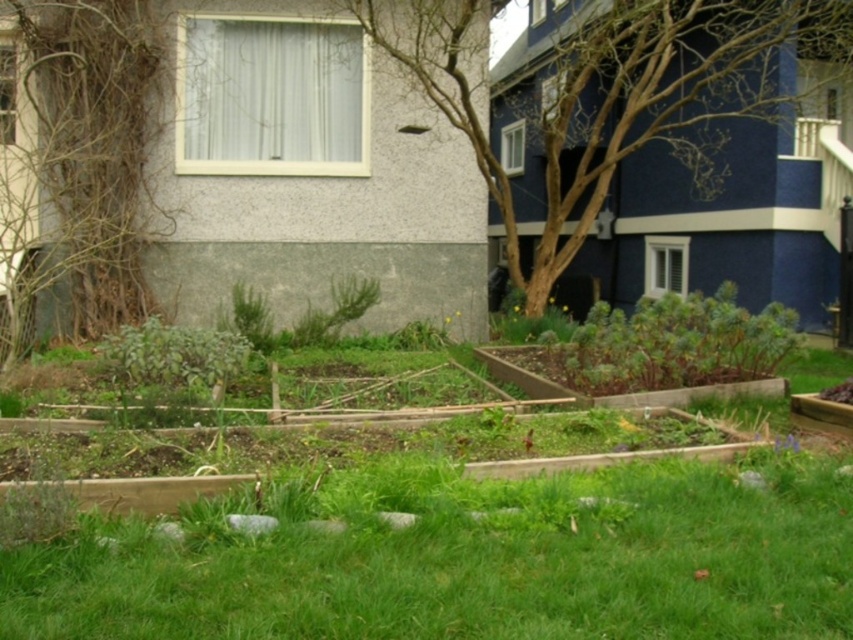
Question: Which point is closer to the camera?

Choices:
 (A) (93, 621)
 (B) (622, 397)
 (C) (131, 65)
 (D) (624, 65)

Answer: (A)

Question: In this image, where is green grass at lower center located relative to brown textured tree at center?

Choices:
 (A) left
 (B) right

Answer: (A)

Question: From the image, what is the correct spatial relationship of green grass at lower center in relation to brown textured tree at left?

Choices:
 (A) below
 (B) above

Answer: (A)

Question: Which point appears farthest from the camera in this image?

Choices:
 (A) (120, 209)
 (B) (577, 522)
 (C) (379, 36)

Answer: (A)

Question: Among these objects, which one is farthest from the camera?

Choices:
 (A) brown textured tree at center
 (B) green grass at lower center

Answer: (A)

Question: Does green grass at lower center appear over brown textured tree at center?

Choices:
 (A) yes
 (B) no

Answer: (B)